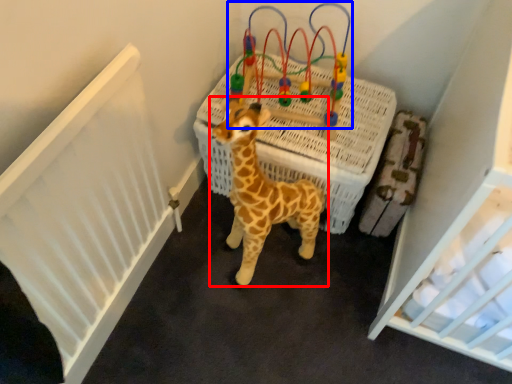
Question: Which point is further to the camera, giraffe (highlighted by a red box) or toy (highlighted by a blue box)?

Choices:
 (A) giraffe
 (B) toy

Answer: (B)